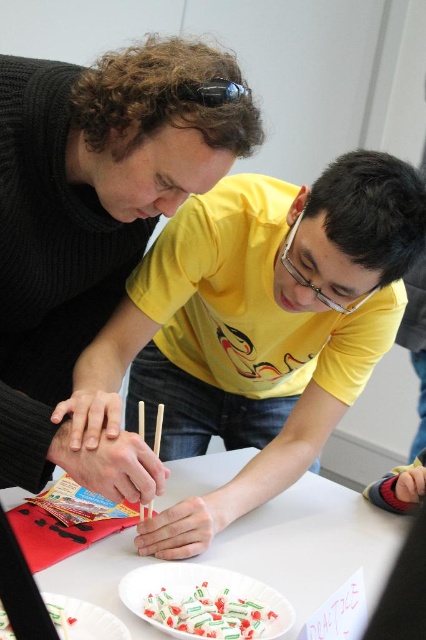
Question: Observing the image, what is the correct spatial positioning of black matte shirt at center in reference to black rubber goggles at upper center?

Choices:
 (A) above
 (B) below

Answer: (B)

Question: Which of the following is the farthest from the observer?

Choices:
 (A) wooden chopsticks at center
 (B) white glossy plate at lower left
 (C) black matte shirt at center
 (D) white paper plate at center

Answer: (A)

Question: Can you confirm if white glossy candy at lower center is smaller than white glossy plate at lower left?

Choices:
 (A) yes
 (B) no

Answer: (A)

Question: Can you confirm if white glossy candy at lower center is thinner than white glossy plate at lower left?

Choices:
 (A) no
 (B) yes

Answer: (A)

Question: Which object is the farthest from the black rubber goggles at upper center?

Choices:
 (A) white glossy candy at lower center
 (B) white paper plate at center

Answer: (B)

Question: Which point is closer to the camera?

Choices:
 (A) black rubber goggles at upper center
 (B) white paper plate at center
 (C) wooden chopsticks at center
 (D) white glossy candy at lower center

Answer: (D)